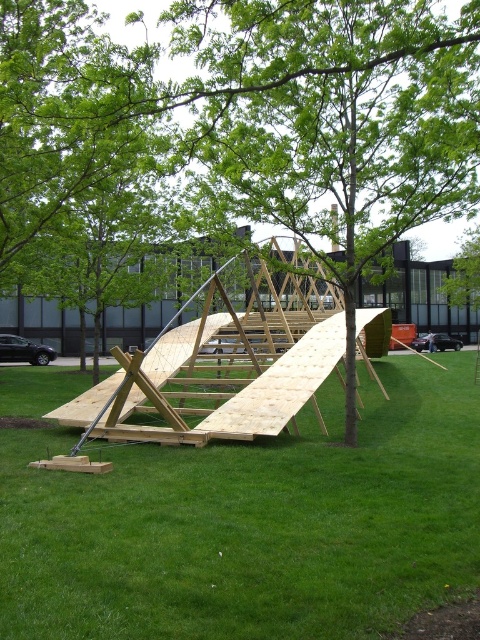
Looking at this image, which is more to the right, green grassy at center or green leafy tree at center?

Positioned to the right is green grassy at center.

This screenshot has height=640, width=480. I want to click on green grassy at center, so click(252, 524).